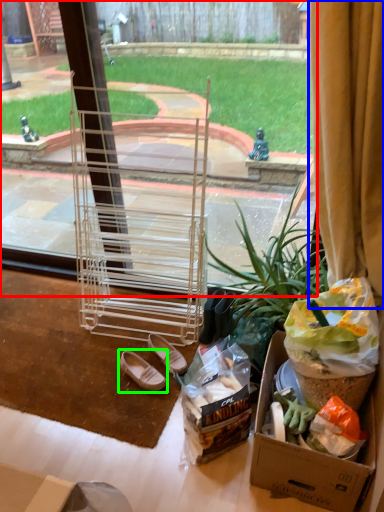
Question: Which object is the farthest from window screen (highlighted by a red box)? Choose among these: curtain (highlighted by a blue box) or footwear (highlighted by a green box).

Choices:
 (A) curtain
 (B) footwear

Answer: (B)